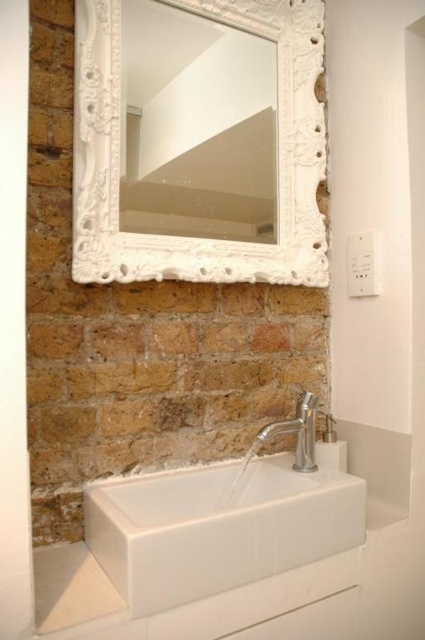
You are a plumber checking the plumbing in the bathroom. You see the white glossy sink at center and the silver metallic faucet at lower center. Which object is positioned to the left of the other?

The white glossy sink at center is to the left of the silver metallic faucet at lower center.

You are standing in the bathroom and notice two points marked on the wall behind the sink. According to their coordinates, which point is closer to you, point (311, 476) or point (294, 460)?

Point (311, 476) is in front of point (294, 460), so it is closer to you.

You are a plumber trying to fix the silver metallic faucet at lower center. You need to access it but the white carved mirror at upper center is blocking your view. Can you move the mirror to the side?

The white carved mirror at upper center is in front of the silver metallic faucet at lower center, so moving the mirror would allow better access to the faucet.